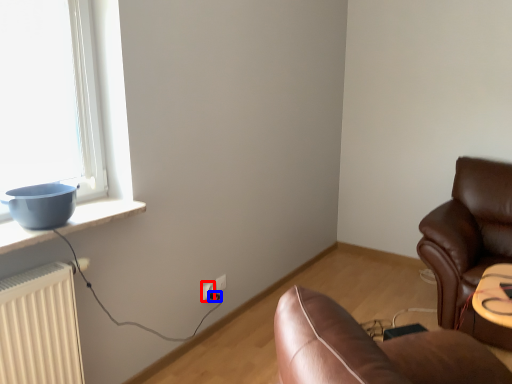
Question: Which point is further to the camera, electric outlet (highlighted by a red box) or plug (highlighted by a blue box)?

Choices:
 (A) electric outlet
 (B) plug

Answer: (B)